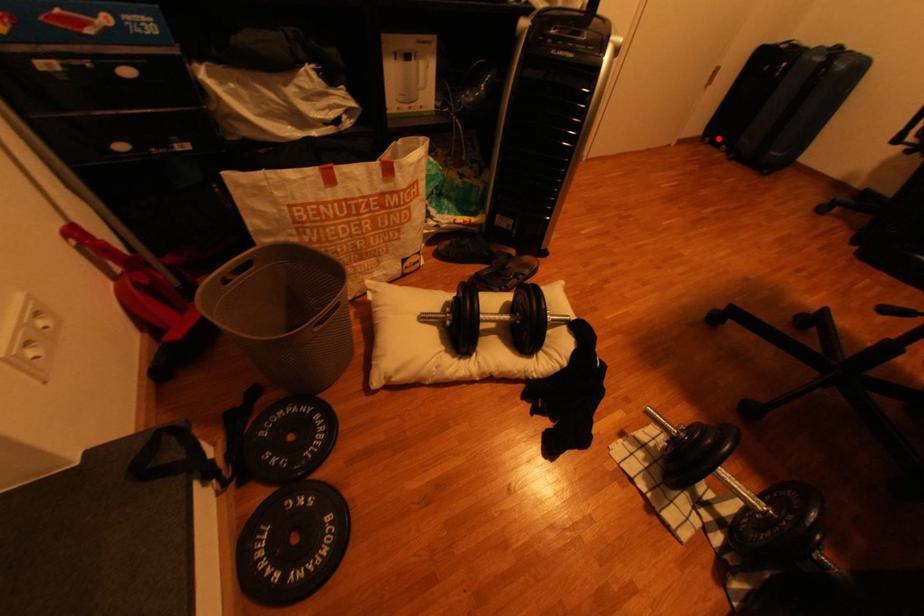
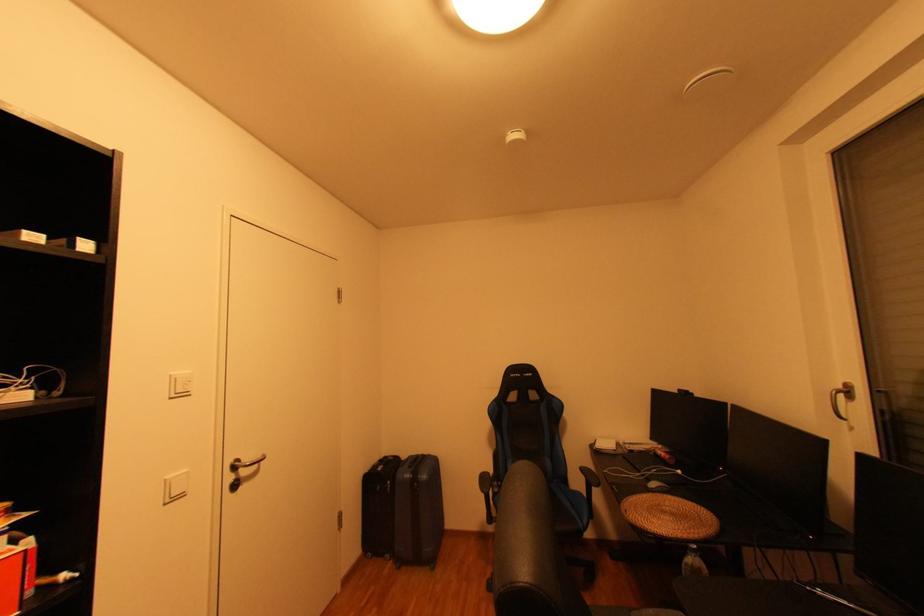
In the second image, find the point that corresponds to the highlighted location in the first image.

(380, 554)